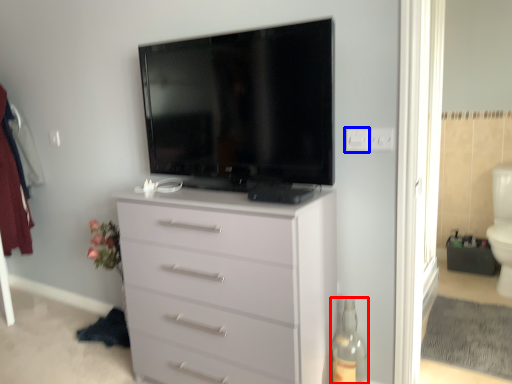
Question: Which object appears closest to the camera in this image, bottle (highlighted by a red box) or electric outlet (highlighted by a blue box)?

Choices:
 (A) bottle
 (B) electric outlet

Answer: (A)